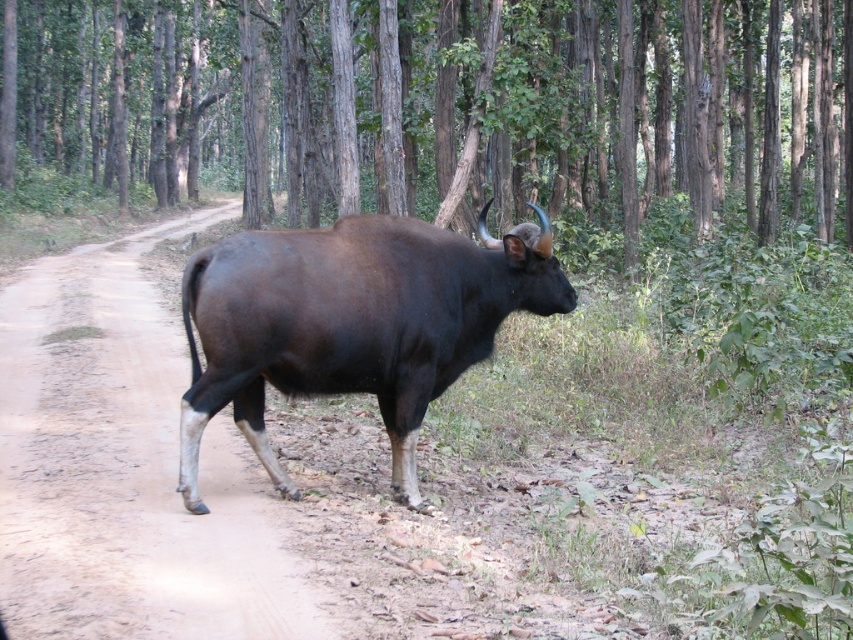
You are a hiker walking along the dirt path and see the brown wood tree at center and the shiny dark brown bull at center. Which object is positioned higher in the scene?

The brown wood tree at center is positioned higher than the shiny dark brown bull at center in the scene.